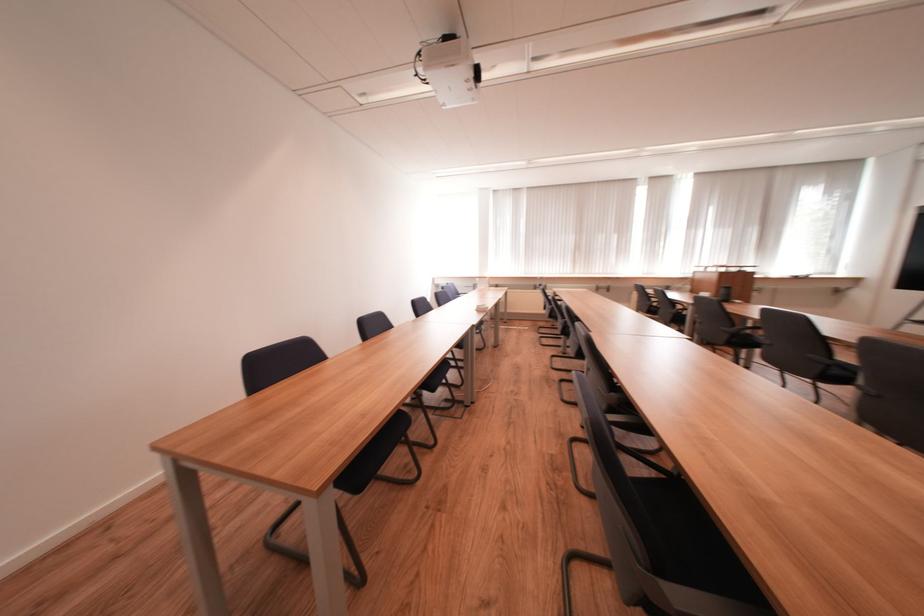
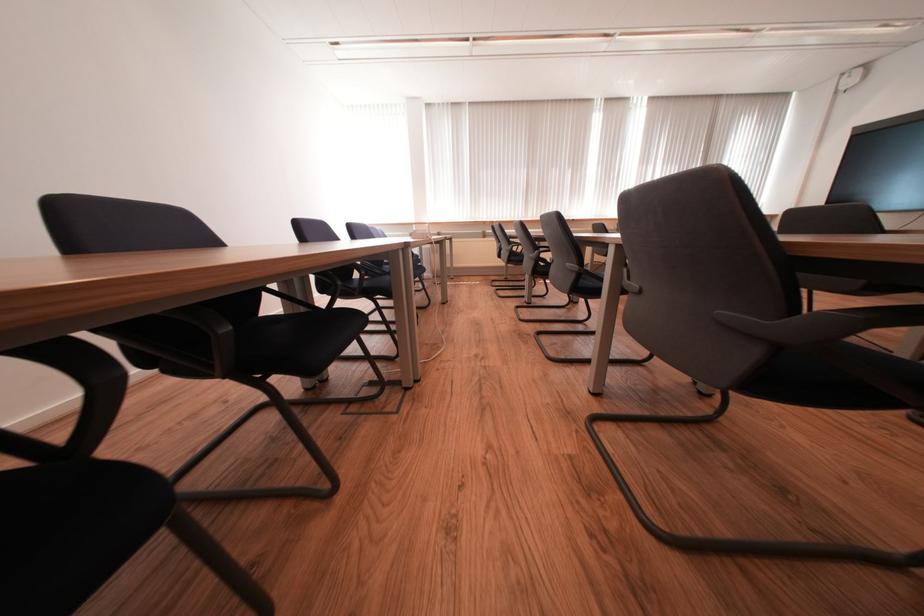
Question: Based on the continuous images, in which direction is the camera rotating? Reply with the corresponding letter.

Choices:
 (A) Left
 (B) Right
 (C) Up
 (D) Down

Answer: (B)